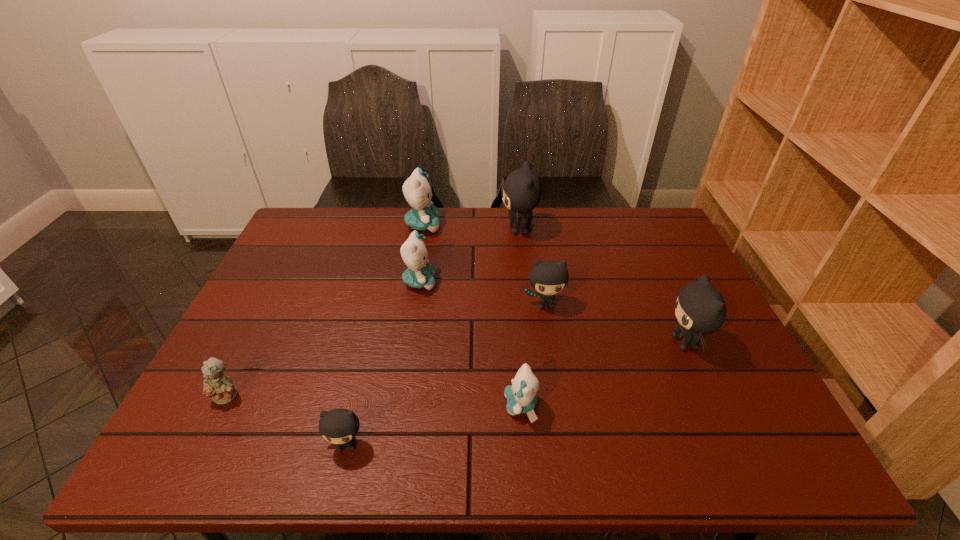
Where is `the farthest gray kitten`? This screenshot has height=540, width=960. the farthest gray kitten is located at coordinates (522, 190).

Find the location of a particular element. Image resolution: width=960 pixels, height=540 pixels. the farthest blue kitten is located at coordinates (x=416, y=189).

The width and height of the screenshot is (960, 540). Identify the location of the rightmost gray kitten. (700, 309).

Locate an element on the screen. the rightmost object is located at coordinates 700,309.

Identify the location of the second farthest blue kitten. (420, 273).

Find the location of `the second smallest gray kitten`. the second smallest gray kitten is located at coordinates tap(548, 278).

Locate an element on the screen. The width and height of the screenshot is (960, 540). the smallest blue kitten is located at coordinates (521, 396).

Where is `the nearest blue kitten`? This screenshot has height=540, width=960. the nearest blue kitten is located at coordinates (521, 396).

Locate an element on the screen. The width and height of the screenshot is (960, 540). teddy bear is located at coordinates (219, 387).

In order to click on blue teddy bear in this screenshot , I will do `click(219, 387)`.